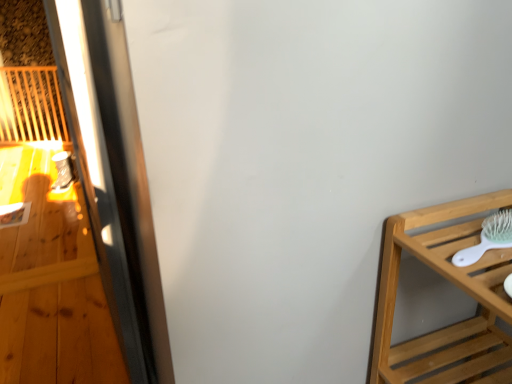
Question: Would you say light brown wooden shelf at right is a long distance from white plastic brush at right?

Choices:
 (A) yes
 (B) no

Answer: (B)

Question: Does light brown wooden shelf at right have a lesser width compared to white plastic brush at right?

Choices:
 (A) no
 (B) yes

Answer: (A)

Question: Is light brown wooden shelf at right facing towards white plastic brush at right?

Choices:
 (A) yes
 (B) no

Answer: (B)

Question: Is light brown wooden shelf at right shorter than white plastic brush at right?

Choices:
 (A) no
 (B) yes

Answer: (A)

Question: Considering the relative sizes of light brown wooden shelf at right and white plastic brush at right in the image provided, is light brown wooden shelf at right taller than white plastic brush at right?

Choices:
 (A) yes
 (B) no

Answer: (A)

Question: Does light brown wooden shelf at right have a larger size compared to white plastic brush at right?

Choices:
 (A) yes
 (B) no

Answer: (A)

Question: Is white plastic brush at right at the left side of metallic screen door at left?

Choices:
 (A) no
 (B) yes

Answer: (A)

Question: Is white plastic brush at right wider than metallic screen door at left?

Choices:
 (A) yes
 (B) no

Answer: (A)

Question: Is metallic screen door at left a part of white plastic brush at right?

Choices:
 (A) no
 (B) yes

Answer: (A)

Question: Does white plastic brush at right have a larger size compared to metallic screen door at left?

Choices:
 (A) no
 (B) yes

Answer: (A)

Question: Considering the relative sizes of white plastic brush at right and metallic screen door at left in the image provided, is white plastic brush at right shorter than metallic screen door at left?

Choices:
 (A) yes
 (B) no

Answer: (A)

Question: Would you say white plastic brush at right is a long distance from metallic screen door at left?

Choices:
 (A) yes
 (B) no

Answer: (B)

Question: From a real-world perspective, is light brown wooden shelf at right physically above metallic screen door at left?

Choices:
 (A) no
 (B) yes

Answer: (A)